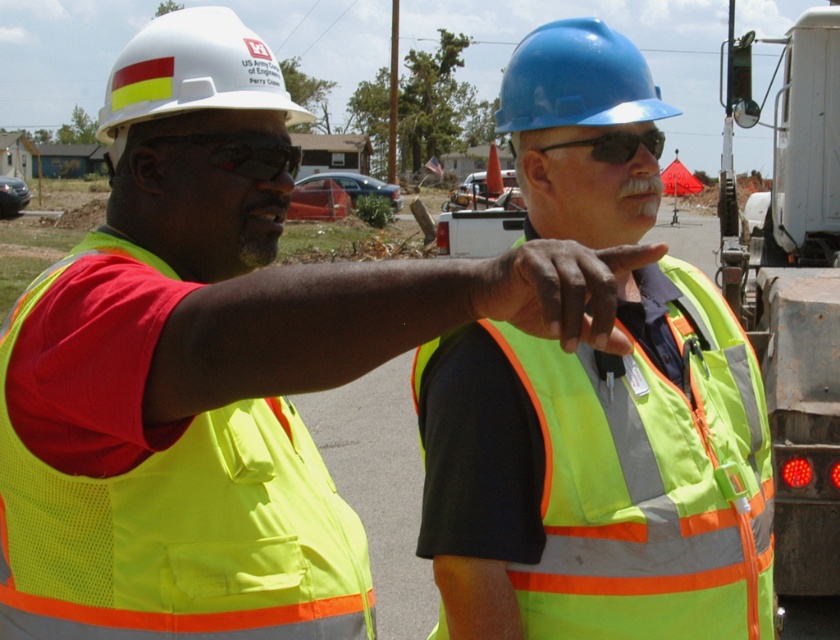
You are an inspector at the construction site. You need to determine which of the two goggles, the matte black goggles at center or the black plastic goggles at upper center, is closer to the ground. Based on the spatial relationship between them, which one is lower?

The matte black goggles at center is taller than the black plastic goggles at upper center, so the black plastic goggles at upper center is lower and closer to the ground.

You are a safety inspector at the construction site. You notice a point marked at coordinates (242, 152). What object is located at that point?

The point at coordinates (242, 152) marks matte black goggles at center.

In the scene shown: You are standing at the camera position and want to reach the point marked at coordinates [242,456]. If your stride length is 2.5 feet per step, how many steps do you need to take to reach that point?

The point marked at coordinates [242,456] is 5.50 feet away from the camera. Since each step covers 2.5 feet, dividing 5.50 by 2.5 gives approximately 2.2 steps. Therefore, you would need to take 3 steps to reach the point, as partial steps are rounded up to ensure arrival.